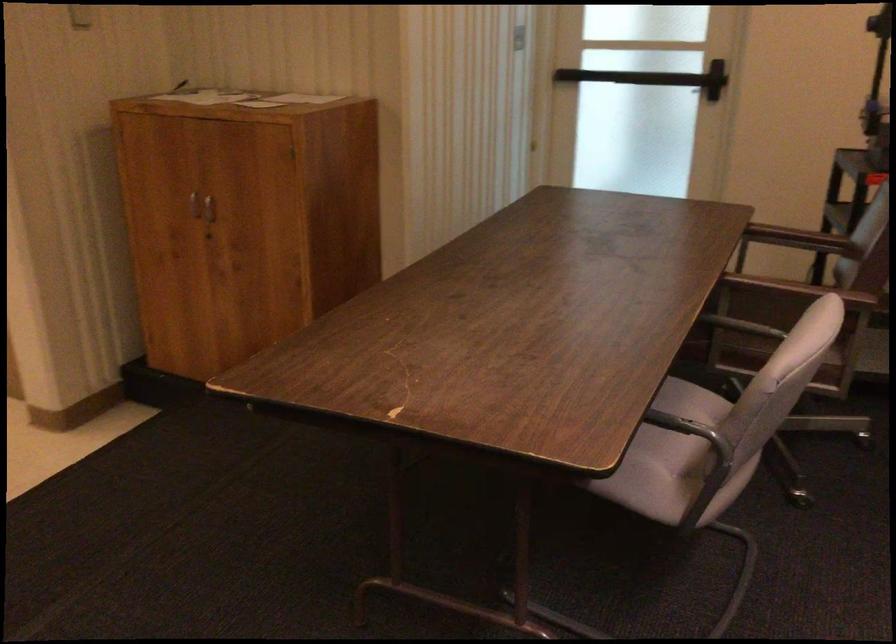
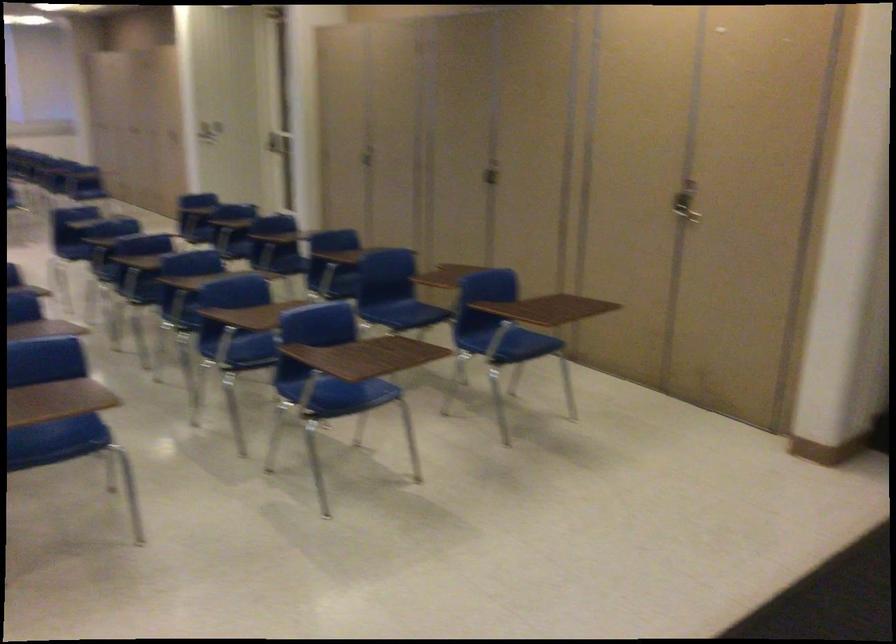
Which direction would the cameraman need to move to produce the second image?

The cameraman walked toward left, backward.